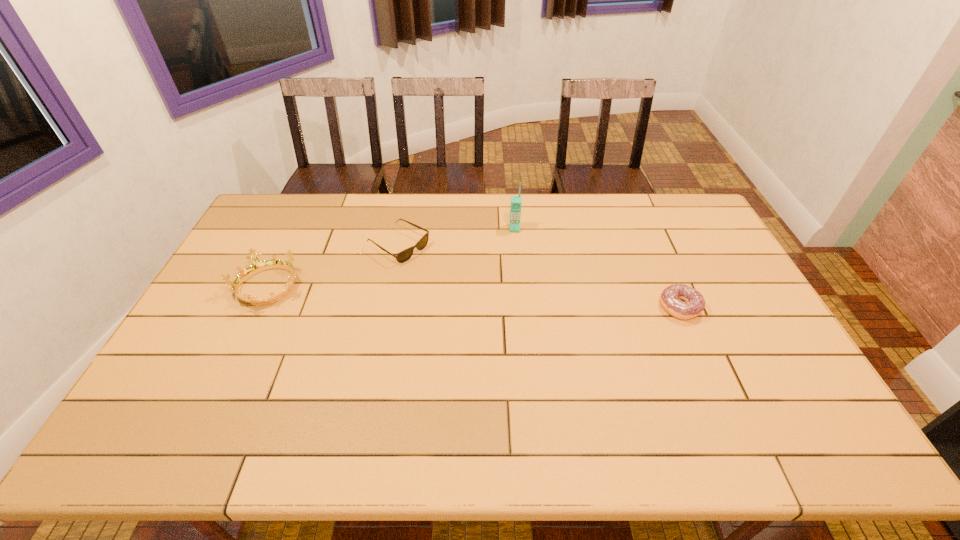
You are a GUI agent. You are given a task and a screenshot of the screen. Output one action in this format:
    pyautogui.click(x=<x>, y=<y>)
    Task: Click on the unoccupied area between the rightmost object and the third object from left to right
    This screenshot has width=960, height=540.
    Given the screenshot: What is the action you would take?
    pyautogui.click(x=597, y=268)

Where is `empty space between the third object from left to right and the rightmost object`? empty space between the third object from left to right and the rightmost object is located at coordinates [597, 268].

Where is `object that is the third closest to the sunglasses`? This screenshot has width=960, height=540. object that is the third closest to the sunglasses is located at coordinates (671, 297).

Locate an element on the screen. This screenshot has height=540, width=960. object that is the third closest to the doughnut is located at coordinates (257, 266).

This screenshot has height=540, width=960. Find the location of `vacant area that satisfies the following two spatial constraints: 1. on the back side of the third object from right to left; 2. on the left side of the tallest object`. vacant area that satisfies the following two spatial constraints: 1. on the back side of the third object from right to left; 2. on the left side of the tallest object is located at coordinates (402, 228).

Image resolution: width=960 pixels, height=540 pixels. In order to click on free point that satisfies the following two spatial constraints: 1. on the front side of the doughnut; 2. on the left side of the second object from left to right in this screenshot , I will do `click(386, 307)`.